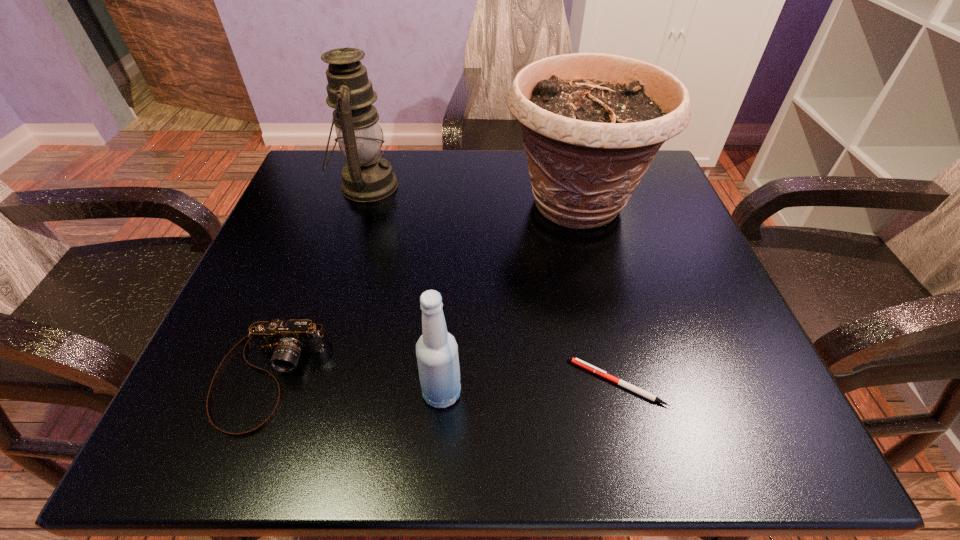
Find the location of a particular element. The height and width of the screenshot is (540, 960). pen present at the right edge is located at coordinates (602, 373).

Where is `object present at the far left corner`? object present at the far left corner is located at coordinates (367, 177).

Find the location of a particular element. object present at the near left corner is located at coordinates (286, 340).

Find the location of a particular element. The height and width of the screenshot is (540, 960). object present at the far right corner is located at coordinates (592, 123).

At what (x,y) coordinates should I click in order to perform the action: click on object that is positioned at the near right corner. Please return your answer as a coordinate pair (x, y). The width and height of the screenshot is (960, 540). Looking at the image, I should click on (602, 373).

Image resolution: width=960 pixels, height=540 pixels. I want to click on free spot at the far edge of the desktop, so click(x=451, y=164).

In the image, there is a desktop. Identify the location of free space at the near edge. Image resolution: width=960 pixels, height=540 pixels. (355, 430).

The height and width of the screenshot is (540, 960). I want to click on free spot at the left edge of the desktop, so click(x=282, y=318).

The image size is (960, 540). In order to click on free region at the right edge in this screenshot , I will do `click(638, 268)`.

This screenshot has height=540, width=960. I want to click on vacant space at the near left corner, so click(226, 402).